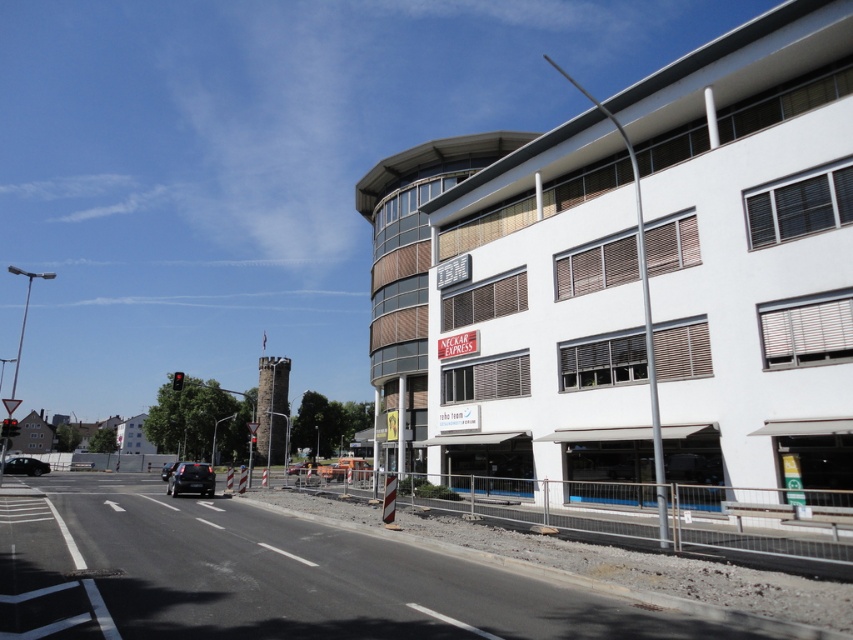
You are standing on an urban street looking at the construction site. There are two points marked on the ground at coordinates point (28, 460) and point (169, 470). Which point is closer to you?

Point (28, 460) is further to the viewer than point (169, 470), so the closer point to you is point (169, 470).

You are a delivery driver who needs to park your shiny black car at center in a parking spot located at point 0.750, 0.225. Can you confirm if the car is already in the correct parking spot?

The shiny black car at center is exactly at point (190, 480), so it is already parked in the correct parking spot.

You are a delivery driver who needs to park your vehicle between two cars in the image. The shiny black car at center and the matte black car at center are both in your way. Which car should you move to the left to create space?

You should move the shiny black car at center to the left since it is currently positioned to the right of the matte black car at center, creating an obstruction. Moving it left would allow space between them for parking.